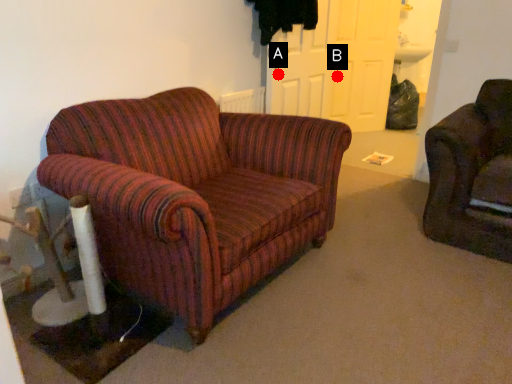
Question: Two points are circled on the image, labeled by A and B beside each circle. Among these points, which one is farthest from the camera?

Choices:
 (A) A is further
 (B) B is further

Answer: (B)